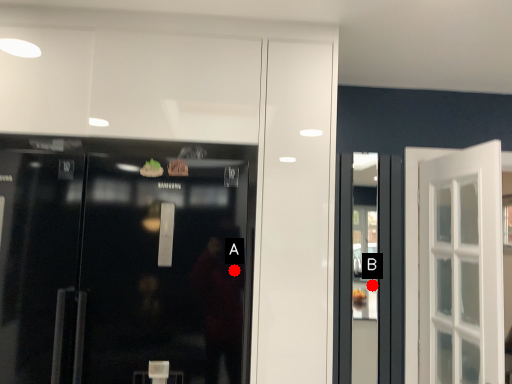
Question: Two points are circled on the image, labeled by A and B beside each circle. Which point is closer to the camera?

Choices:
 (A) A is closer
 (B) B is closer

Answer: (A)